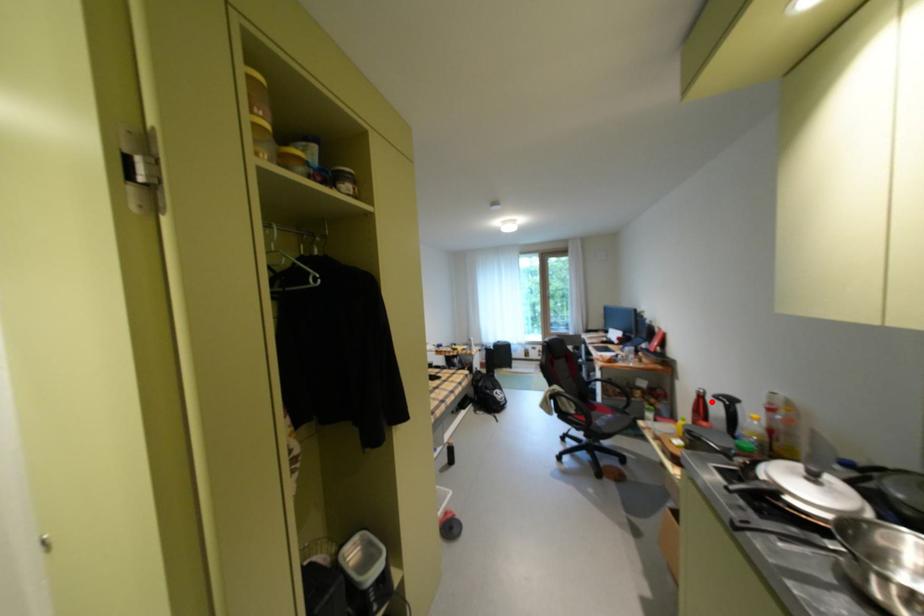
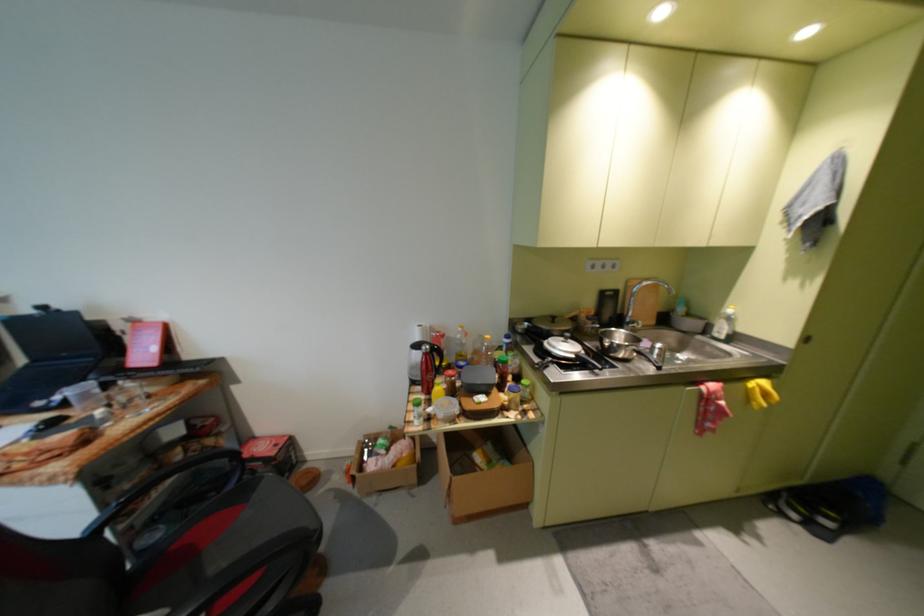
In the second image, find the point that corresponds to the highlighted location in the first image.

(439, 358)